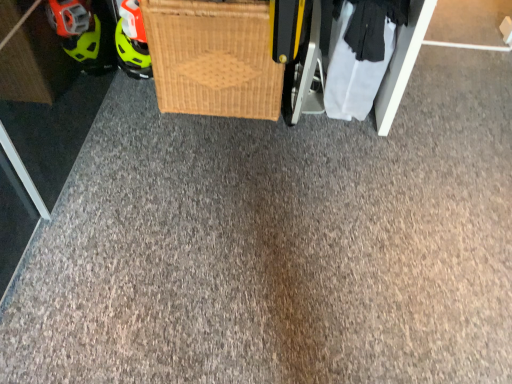
Question: Does white fabric at lower right have a greater width compared to woven wood basket at center?

Choices:
 (A) no
 (B) yes

Answer: (A)

Question: Is woven wood basket at center surrounded by white fabric at lower right?

Choices:
 (A) yes
 (B) no

Answer: (B)

Question: Can we say white fabric at lower right lies outside woven wood basket at center?

Choices:
 (A) yes
 (B) no

Answer: (A)

Question: From a real-world perspective, is white fabric at lower right on woven wood basket at center?

Choices:
 (A) yes
 (B) no

Answer: (B)

Question: Can you confirm if white fabric at lower right is positioned to the right of woven wood basket at center?

Choices:
 (A) no
 (B) yes

Answer: (B)

Question: From the image's perspective, is white fabric at lower right over woven wood basket at center?

Choices:
 (A) no
 (B) yes

Answer: (A)

Question: From the image's perspective, is woven wood basket at center under white fabric at lower right?

Choices:
 (A) yes
 (B) no

Answer: (B)

Question: Could you tell me if woven wood basket at center is facing white fabric at lower right?

Choices:
 (A) yes
 (B) no

Answer: (B)

Question: Does woven wood basket at center come in front of white fabric at lower right?

Choices:
 (A) no
 (B) yes

Answer: (B)

Question: Considering the relative sizes of woven wood basket at center and white fabric at lower right in the image provided, is woven wood basket at center taller than white fabric at lower right?

Choices:
 (A) no
 (B) yes

Answer: (B)

Question: Would you say white fabric at lower right is part of woven wood basket at center's contents?

Choices:
 (A) no
 (B) yes

Answer: (A)

Question: From a real-world perspective, is woven wood basket at center on top of white fabric at lower right?

Choices:
 (A) yes
 (B) no

Answer: (A)

Question: Do you think white fabric at lower right is within woven wood basket at center, or outside of it?

Choices:
 (A) outside
 (B) inside

Answer: (A)